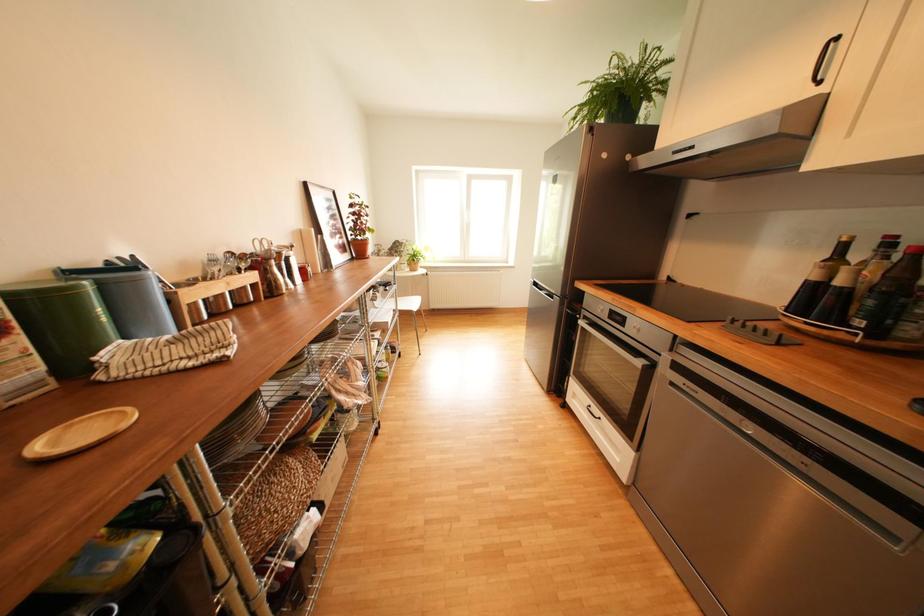
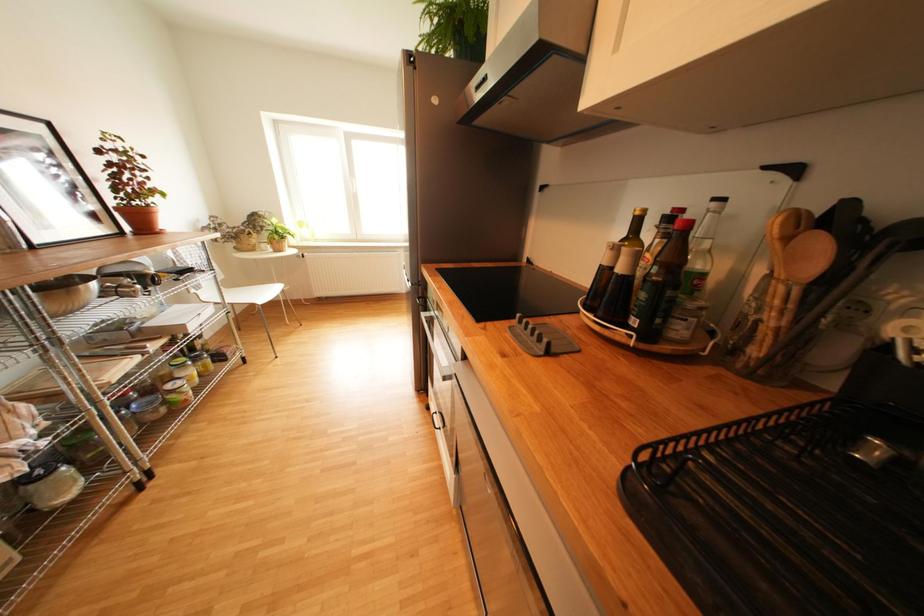
Looking at this image, what movement of the cameraman would produce the second image?

The cameraman walked toward right, forward.